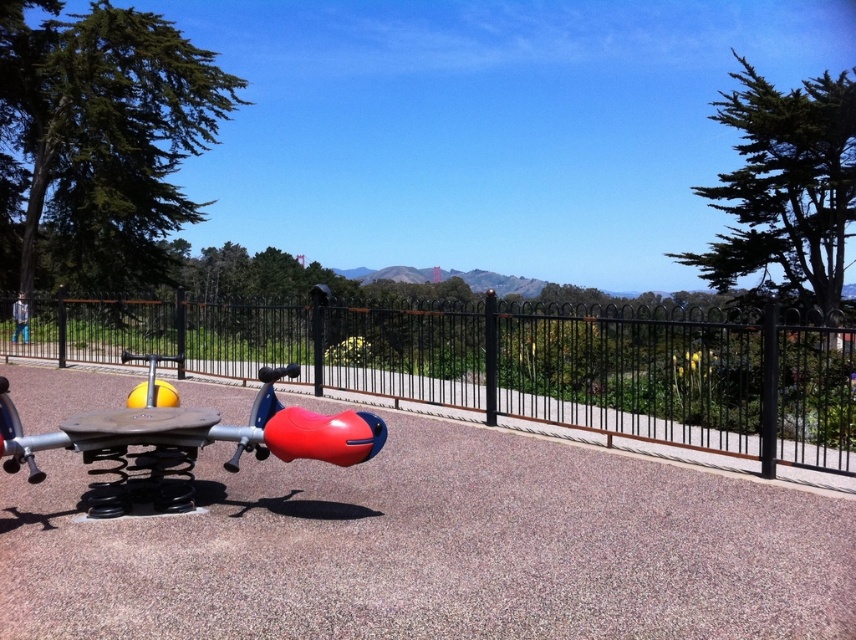
Between black metal fence at center and rubberized plastic seesaw at center, which one appears on the left side from the viewer's perspective?

rubberized plastic seesaw at center

Identify the location of black metal fence at center. The width and height of the screenshot is (856, 640). (506, 364).